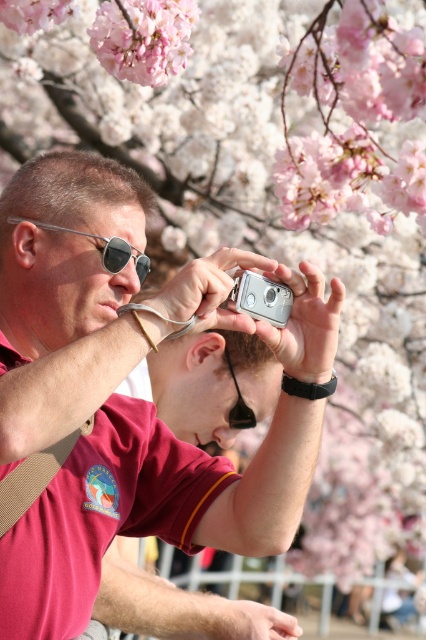
Who is lower down, matte black camera at center or black rubber goggles at center?

black rubber goggles at center

Measure the distance between matte black camera at center and camera.

A distance of 4.72 feet exists between matte black camera at center and camera.

Identify the location of matte black camera at center. (127, 396).

Between point (259, 304) and point (233, 371), which one is positioned behind?

The point (233, 371) is behind.

Which is more to the right, silver metallic camera at center or black rubber goggles at center?

silver metallic camera at center

Who is more forward, (253, 307) or (244, 408)?

Point (253, 307)

This screenshot has width=426, height=640. Identify the location of silver metallic camera at center. (261, 298).

Does matte black camera at center come in front of pink matte flower at upper left?

Yes, it is in front of pink matte flower at upper left.

Find the location of `matte black camera at center`. matte black camera at center is located at coordinates (127, 396).

Locate an element on the screen. Image resolution: width=426 pixels, height=640 pixels. matte black camera at center is located at coordinates tap(127, 396).